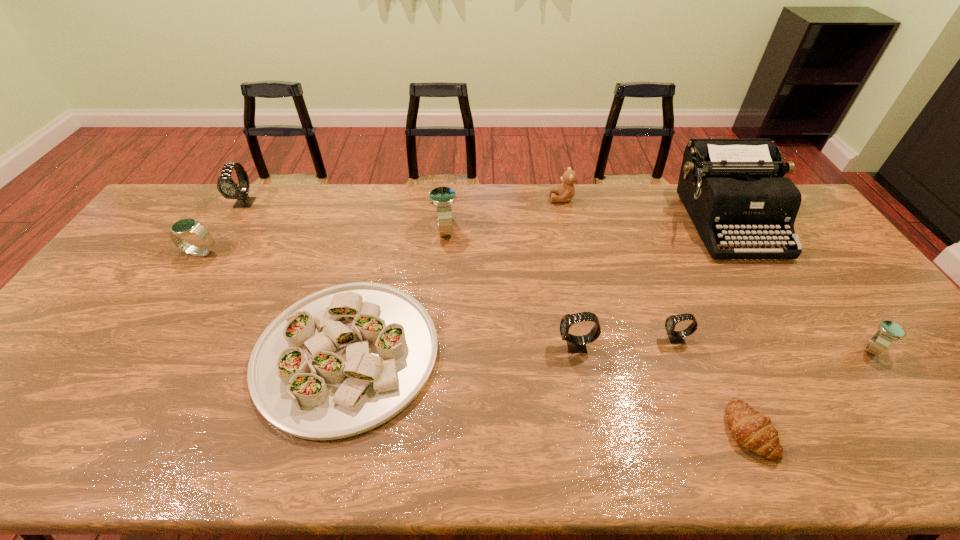
This screenshot has height=540, width=960. I want to click on blank region between the typewriter and the second gray watch from left to right, so click(x=651, y=284).

This screenshot has width=960, height=540. What are the coordinates of `free space between the smallest gray watch and the biggest blue watch` in the screenshot? It's located at point(560,284).

Where is `empty location between the tallest object and the rightmost gray watch`? Image resolution: width=960 pixels, height=540 pixels. empty location between the tallest object and the rightmost gray watch is located at coordinates (700, 280).

This screenshot has width=960, height=540. I want to click on object that is the closest to the second smallest gray watch, so click(x=675, y=337).

Choose which object is the fifth nearest neighbor to the typewriter. Please provide its 2D coordinates. Your answer should be formatted as a tuple, i.e. [(x, y)], where the tuple contains the x and y coordinates of a point satisfying the conditions above.

[(754, 431)]

Where is `the third closest watch to the farthest gray watch`? The image size is (960, 540). the third closest watch to the farthest gray watch is located at coordinates (576, 344).

Select which watch appears as the fourth closest to the white platter. Please provide its 2D coordinates. Your answer should be formatted as a tuple, i.e. [(x, y)], where the tuple contains the x and y coordinates of a point satisfying the conditions above.

[(226, 186)]

Select which gray watch is the third closest to the shortest object. Please provide its 2D coordinates. Your answer should be formatted as a tuple, i.e. [(x, y)], where the tuple contains the x and y coordinates of a point satisfying the conditions above.

[(226, 186)]

Point out which gray watch is positioned as the nearest to the brown teddy bear. Please provide its 2D coordinates. Your answer should be formatted as a tuple, i.e. [(x, y)], where the tuple contains the x and y coordinates of a point satisfying the conditions above.

[(576, 344)]

Where is `blue watch that can be found as the second closest to the shortest object`? The width and height of the screenshot is (960, 540). blue watch that can be found as the second closest to the shortest object is located at coordinates click(x=443, y=198).